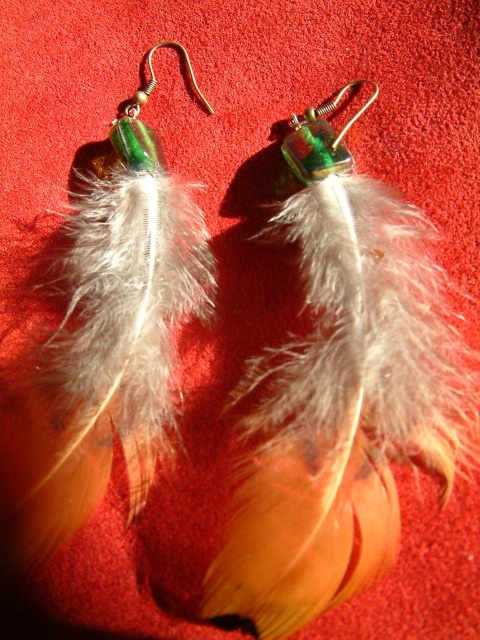
Based on the photo, who is more forward, (183,294) or (288,161)?

Positioned in front is point (183,294).

Can you confirm if feather earrings at center is positioned above green glass hook at center?

Incorrect, feather earrings at center is not positioned above green glass hook at center.

Between point (140, 342) and point (327, 140), which one is positioned behind?

The point (327, 140) is behind.

Locate an element on the screen. This screenshot has width=480, height=640. feather earrings at center is located at coordinates (110, 339).